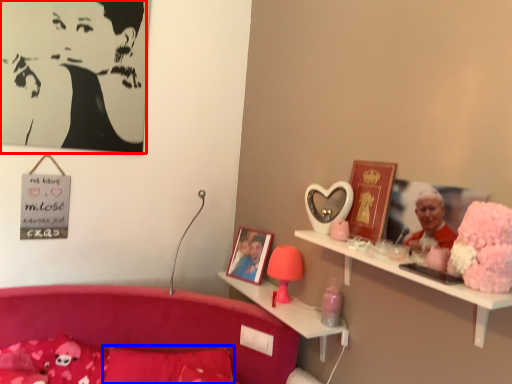
Question: Which object is further to the camera taking this photo, person (highlighted by a red box) or pillow (highlighted by a blue box)?

Choices:
 (A) person
 (B) pillow

Answer: (A)